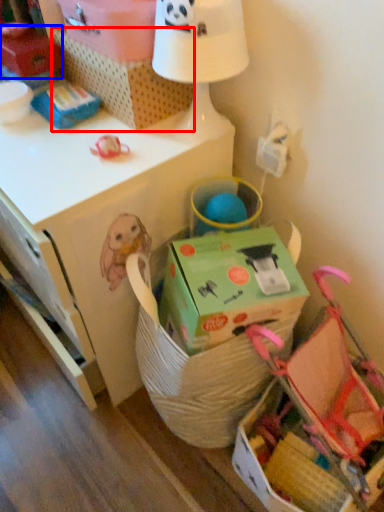
Question: Among these objects, which one is farthest to the camera, storage box (highlighted by a red box) or storage box (highlighted by a blue box)?

Choices:
 (A) storage box
 (B) storage box

Answer: (B)